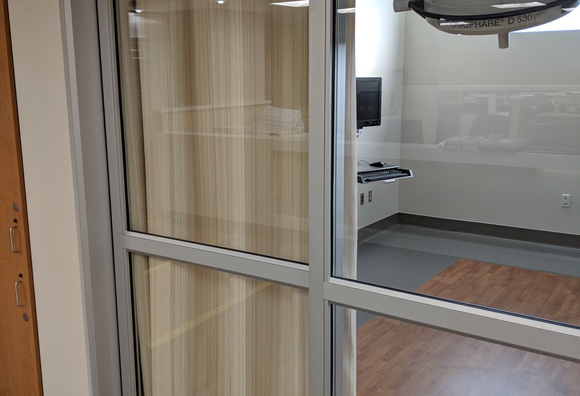
Locate an element on the screen. wooden floor behind window glass is located at coordinates (474, 282), (552, 298), (541, 379), (432, 385), (379, 339).